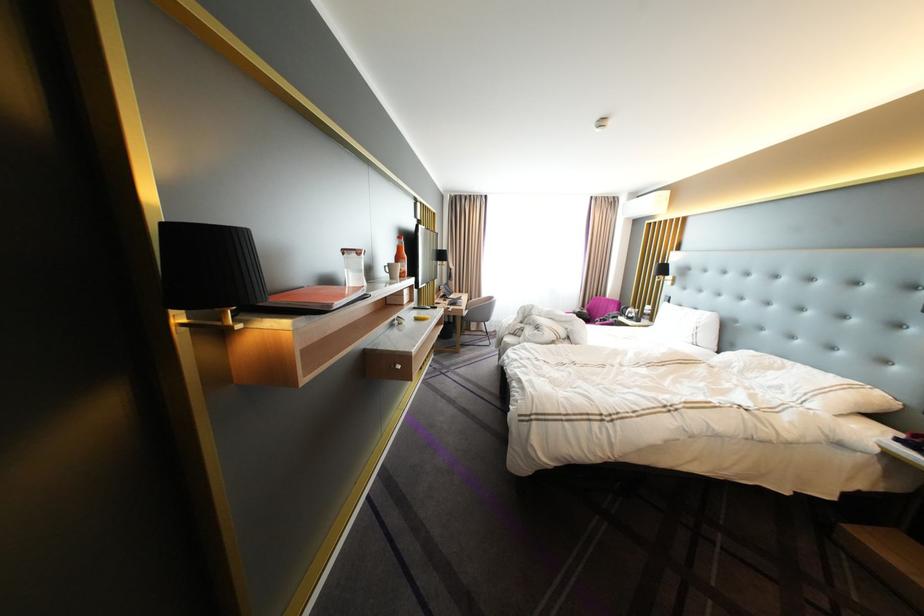
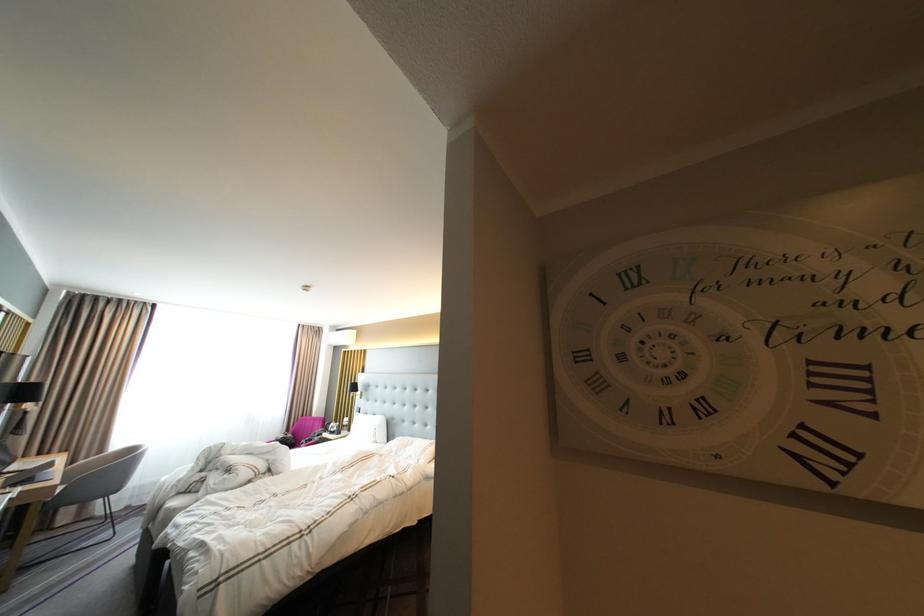
The point at [464,297] is marked in the first image. Where is the corresponding point in the second image?

(27, 468)